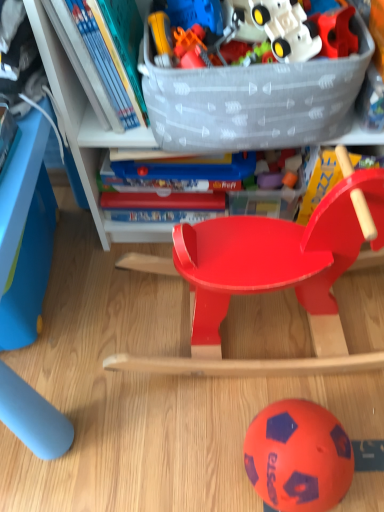
Question: Is rubberized plastic puzzle piece at upper right wider or thinner than orange rubber ball at lower center?

Choices:
 (A) thin
 (B) wide

Answer: (A)

Question: Considering the positions of rubberized plastic puzzle piece at upper right and orange rubber ball at lower center in the image, is rubberized plastic puzzle piece at upper right taller or shorter than orange rubber ball at lower center?

Choices:
 (A) short
 (B) tall

Answer: (A)

Question: Which is farther from the glossy plastic rocking horse at center?

Choices:
 (A) hardcover book at upper left
 (B) translucent plastic storage box at upper center
 (C) matte plastic bookcase at upper center
 (D) rubberized plastic puzzle piece at upper right
 (E) blue plastic table at lower left

Answer: (D)

Question: Estimate the real-world distances between objects in this image. Which object is farther from the blue plastic table at lower left?

Choices:
 (A) orange rubber ball at lower center
 (B) translucent plastic storage box at upper center
 (C) rubberized plastic puzzle piece at upper right
 (D) glossy plastic rocking horse at center
 (E) matte plastic bookcase at upper center

Answer: (C)